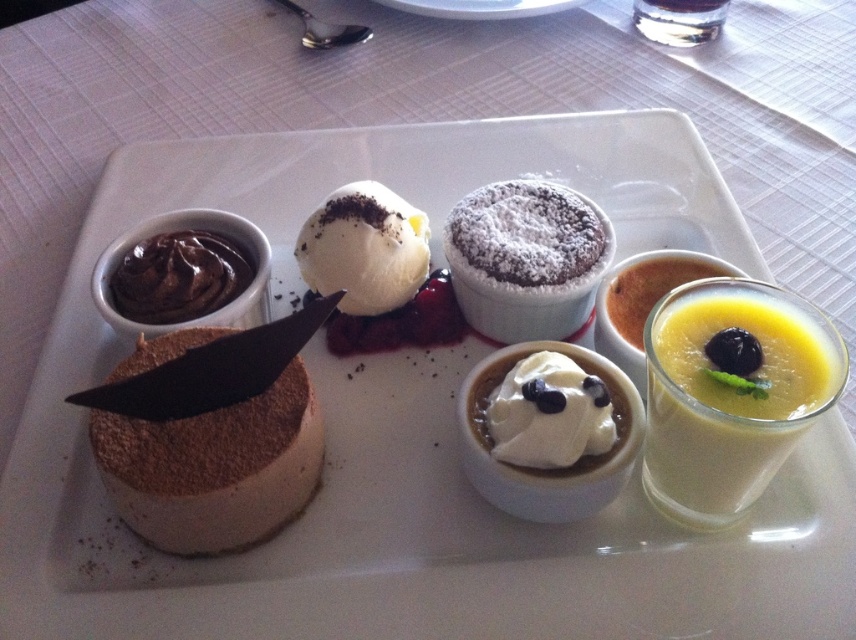
Question: Can you confirm if brown crumbly cake at left is wider than smooth chocolate pudding at upper left?

Choices:
 (A) no
 (B) yes

Answer: (B)

Question: Does powdered chocolate soufflé at center have a lesser width compared to whipped cream topped pudding at center?

Choices:
 (A) no
 (B) yes

Answer: (A)

Question: Is yellow creamy pudding at lower right below whipped cream topped pudding at center?

Choices:
 (A) no
 (B) yes

Answer: (A)

Question: Estimate the real-world distances between objects in this image. Which object is farther from the white creamy ice cream at center?

Choices:
 (A) yellow creamy pudding at upper right
 (B) whipped cream topped pudding at center
 (C) brown crumbly cake at left
 (D) powdered chocolate soufflé at center

Answer: (A)

Question: Which object is farther from the camera taking this photo?

Choices:
 (A) powdered chocolate soufflé at center
 (B) smooth chocolate pudding at upper left

Answer: (A)

Question: Which object appears closest to the camera in this image?

Choices:
 (A) powdered chocolate soufflé at center
 (B) clear glass at upper center
 (C) smooth chocolate pudding at upper left

Answer: (C)